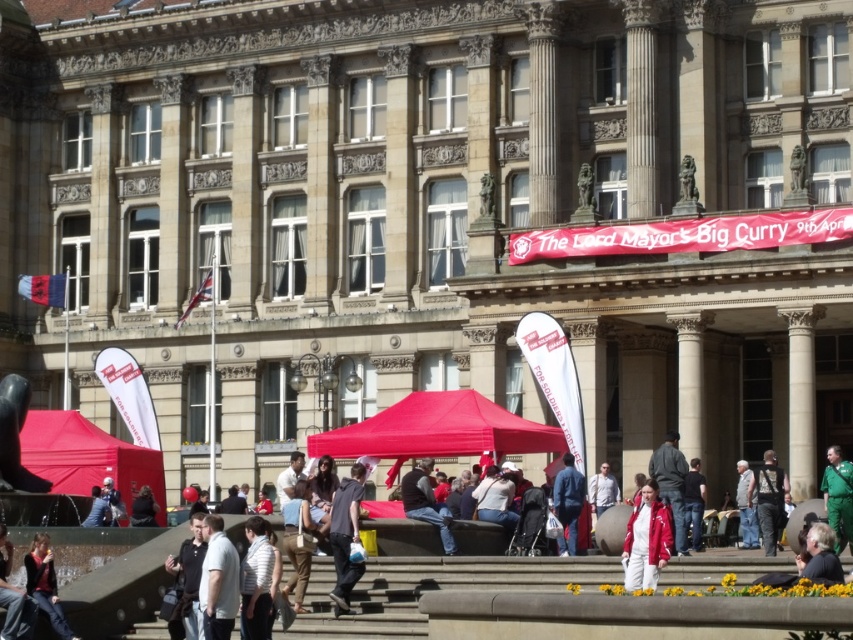
You are a photographer at the event and want to capture a photo that includes both the green uniform at center and the denim jacket at lower left. However, you notice that one of them is partially hidden by the other. Which object is covering part of the other?

The green uniform at center is positioned over denim jacket at lower left, so the green uniform at center is covering part of the denim jacket at lower left.

You are a photographer at the event and want to capture both the khaki pants at center and the denim jacket at lower right in a single shot. Which of the two should you place on the left side of your frame to ensure both are visible?

The khaki pants at center is already positioned on the left side of the denim jacket at lower right, so you should keep the khaki pants at center on the left side of your frame to include both in the shot.